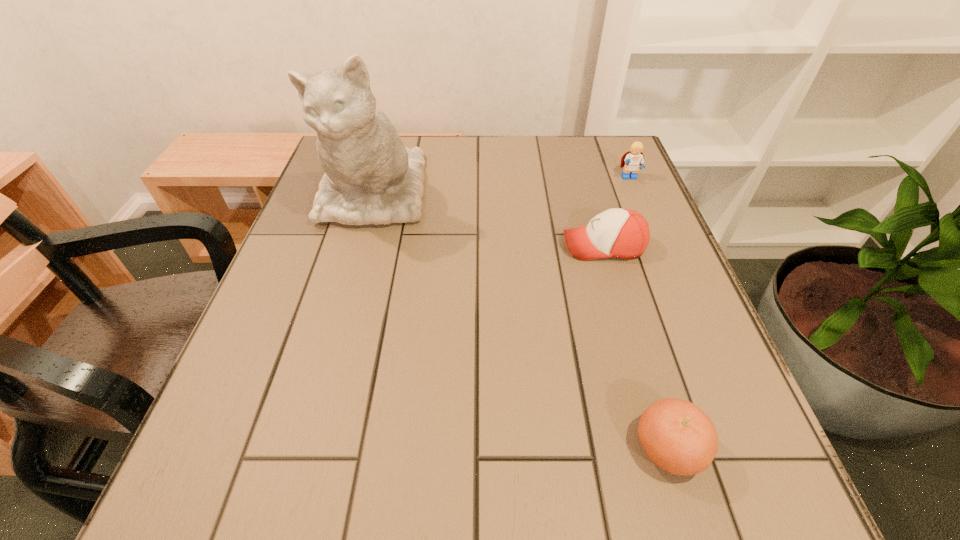
The height and width of the screenshot is (540, 960). Find the location of `free space between the Lego and the nearest object`. free space between the Lego and the nearest object is located at coordinates (649, 313).

Find the location of a particular element. The image size is (960, 540). vacant point located between the cat and the nearest object is located at coordinates (521, 321).

Locate an element on the screen. This screenshot has width=960, height=540. free spot between the clementine and the baseball cap is located at coordinates (636, 347).

Identify the location of vacant space in between the tallest object and the Lego. point(501,186).

I want to click on object that is the second closest to the nearest object, so click(x=370, y=177).

Select which object appears as the closest to the baseball cap. Please provide its 2D coordinates. Your answer should be formatted as a tuple, i.e. [(x, y)], where the tuple contains the x and y coordinates of a point satisfying the conditions above.

[(633, 160)]

Image resolution: width=960 pixels, height=540 pixels. In order to click on free space that satisfies the following two spatial constraints: 1. on the back side of the clementine; 2. on the front-facing side of the baseball cap in this screenshot , I will do tap(608, 246).

You are a GUI agent. You are given a task and a screenshot of the screen. Output one action in this format:
    pyautogui.click(x=<x>, y=<y>)
    Task: Click on the blank space that satisfies the following two spatial constraints: 1. on the back side of the nearest object; 2. on the front-facing side of the baseball cap
    This screenshot has width=960, height=540.
    Given the screenshot: What is the action you would take?
    pyautogui.click(x=608, y=246)

I want to click on blank space that satisfies the following two spatial constraints: 1. on the back side of the nearest object; 2. on the front-facing side of the baseball cap, so click(x=608, y=246).

At what (x,y) coordinates should I click in order to perform the action: click on vacant space that satisfies the following two spatial constraints: 1. on the front-facing side of the cat; 2. on the right side of the nearest object. Please return your answer as a coordinate pair (x, y). Image resolution: width=960 pixels, height=540 pixels. Looking at the image, I should click on (301, 448).